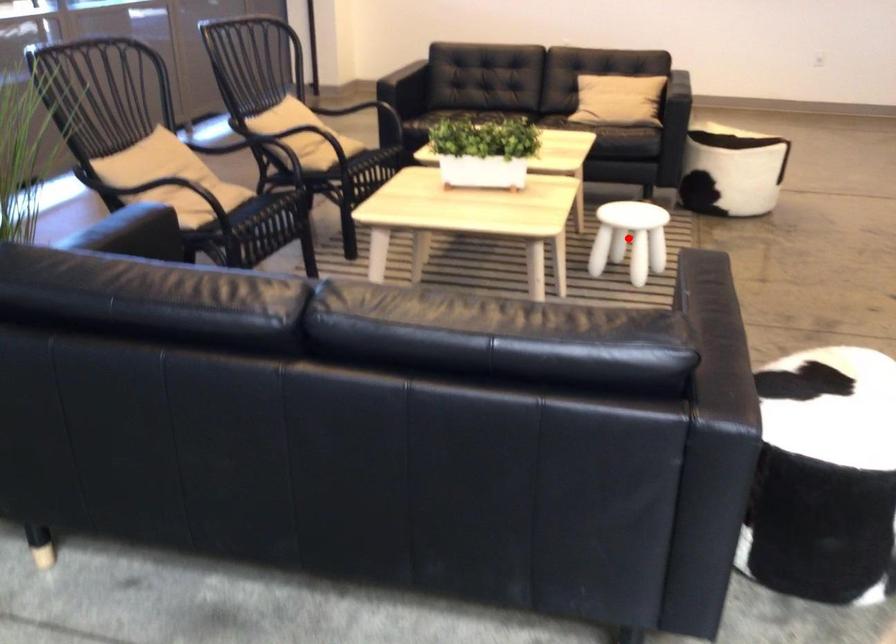
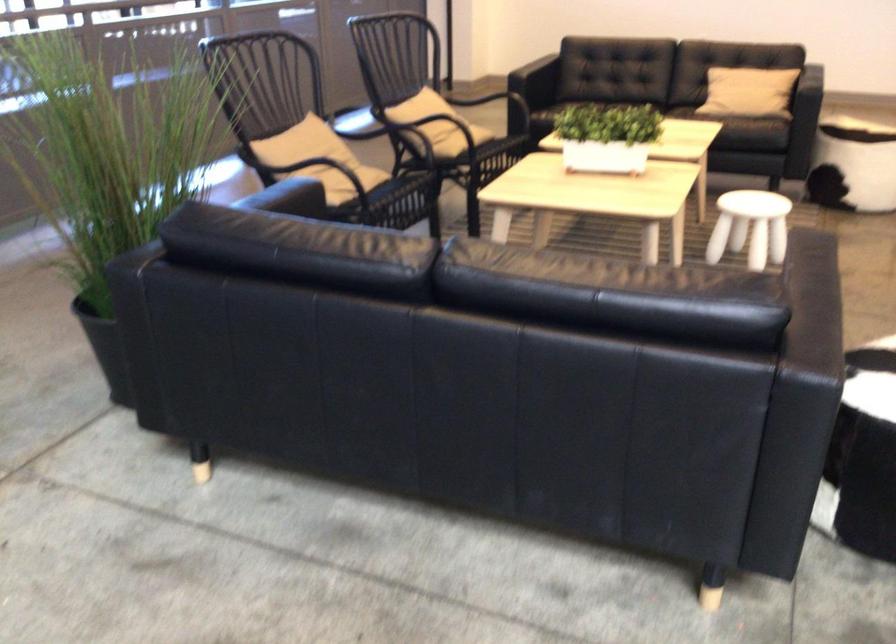
Locate, in the second image, the point that corresponds to the highlighted location in the first image.

(750, 227)